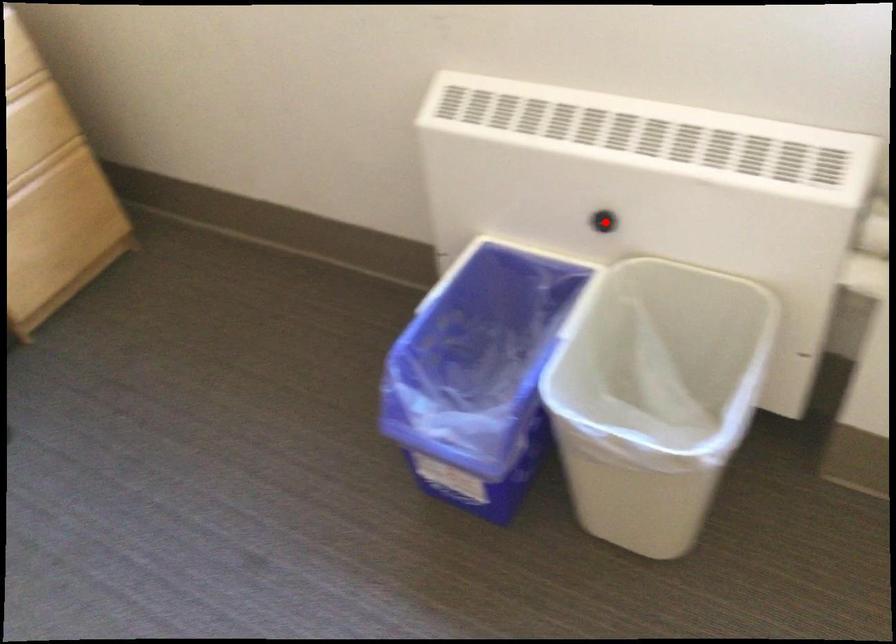
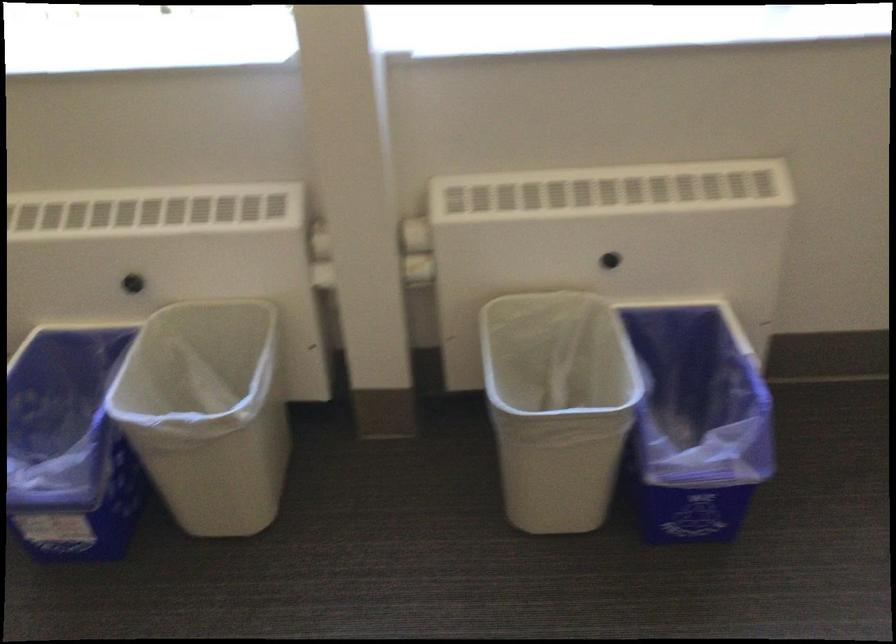
Where in the second image is the point corresponding to the highlighted location from the first image?

(132, 283)